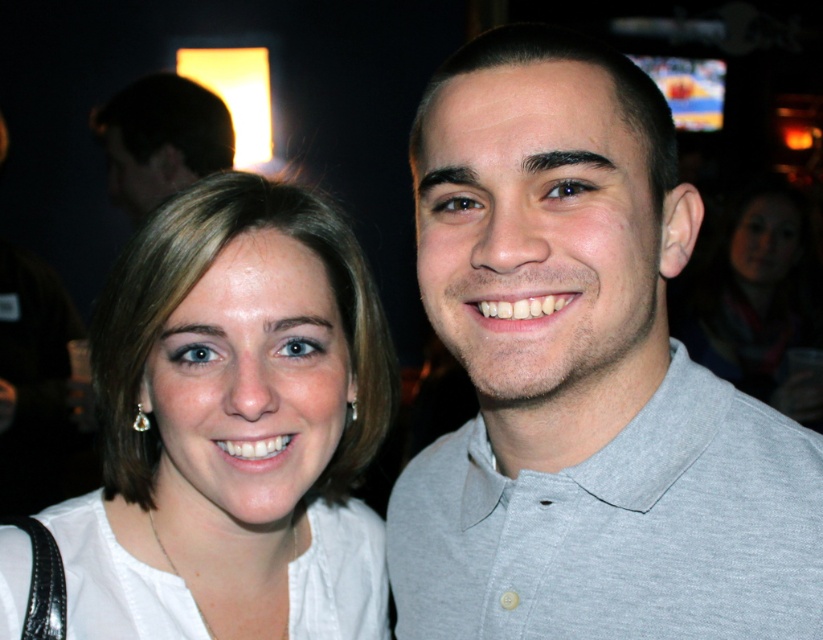
You are a photographer adjusting your camera settings. You notice the gray cotton polo shirt at right and the dark brown hair at upper left in the frame. Which object should you focus on first if you want to capture both in sharp detail?

The gray cotton polo shirt at right is smaller than the dark brown hair at upper left, so you should focus on the gray cotton polo shirt at right first because smaller objects often require precise focus to maintain sharpness.

You are trying to decide which clothing item to take for a casual event. Based on the image, which clothing item is wider between the gray cotton polo shirt at right and the white cotton shirt at center?

The gray cotton polo shirt at right is wider than the white cotton shirt at center according to the description.